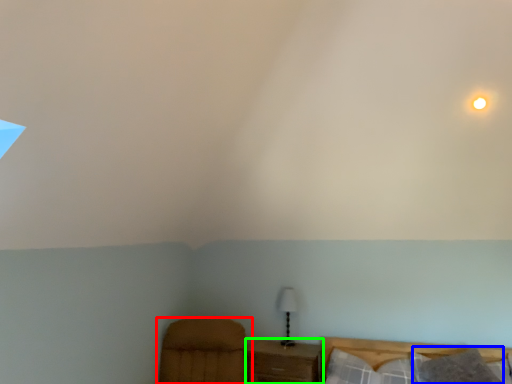
Question: Which object is positioned closest to furniture (highlighted by a red box)? Select from pillow (highlighted by a blue box) and nightstand (highlighted by a green box).

Choices:
 (A) pillow
 (B) nightstand

Answer: (B)